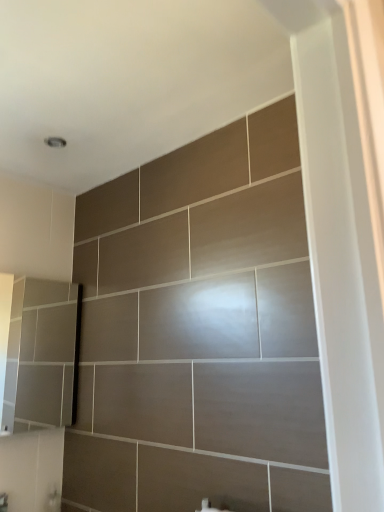
The height and width of the screenshot is (512, 384). What do you see at coordinates (42, 355) in the screenshot?
I see `matte gray medicine cabinet at lower left` at bounding box center [42, 355].

Locate an element on the screen. The height and width of the screenshot is (512, 384). matte gray medicine cabinet at lower left is located at coordinates (42, 355).

Locate an element on the screen. The height and width of the screenshot is (512, 384). matte gray medicine cabinet at lower left is located at coordinates (42, 355).